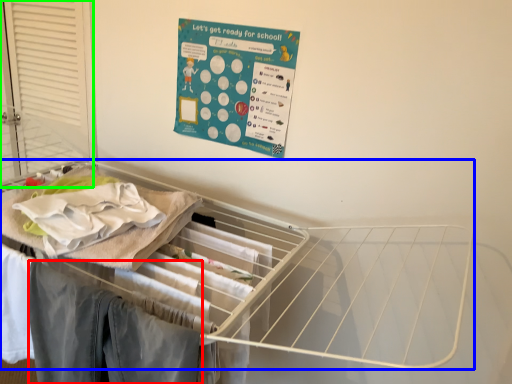
Question: Based on their relative distances, which object is nearer to clothing (highlighted by a red box)? Choose from furniture (highlighted by a blue box) and screen door (highlighted by a green box).

Choices:
 (A) furniture
 (B) screen door

Answer: (A)